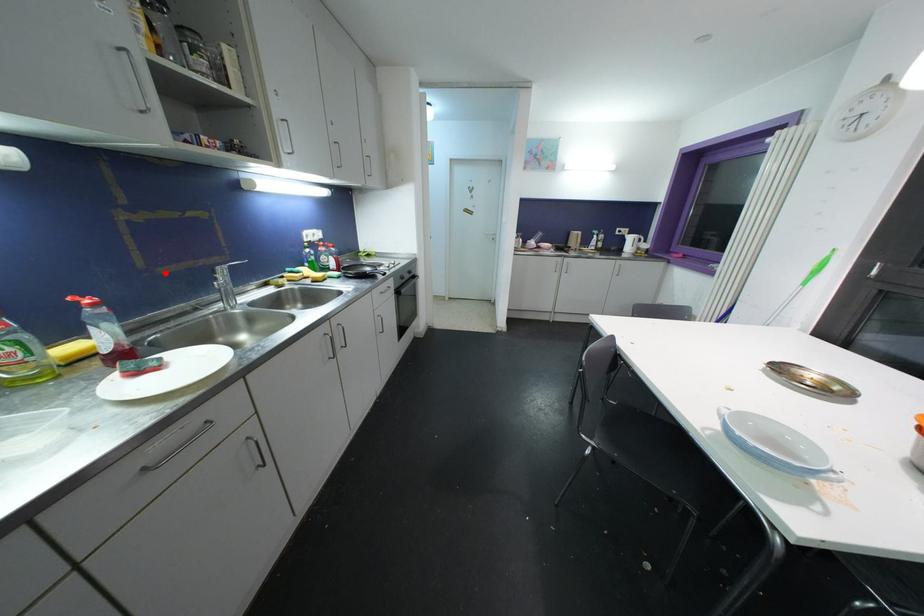
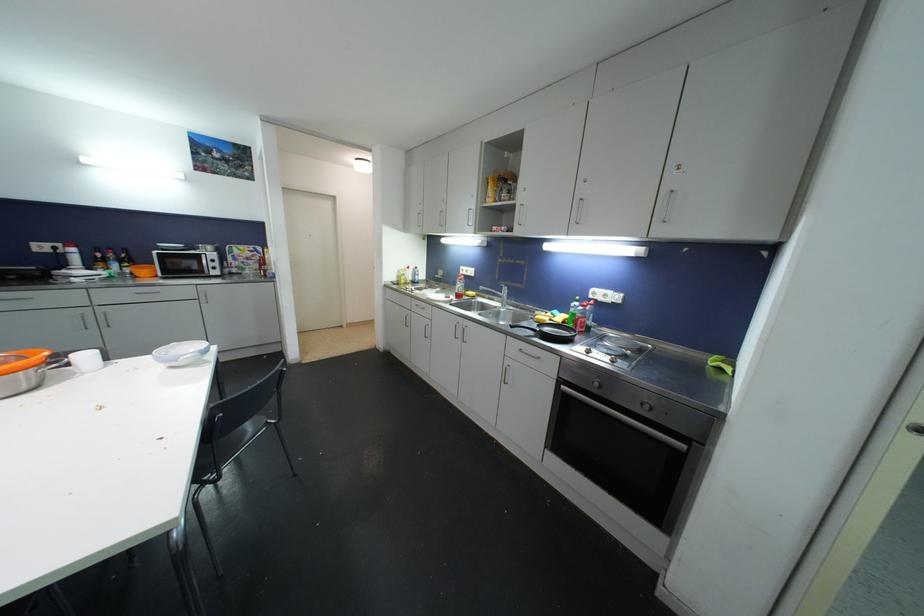
Locate, in the second image, the point that corresponds to the highlighted location in the first image.

(504, 285)